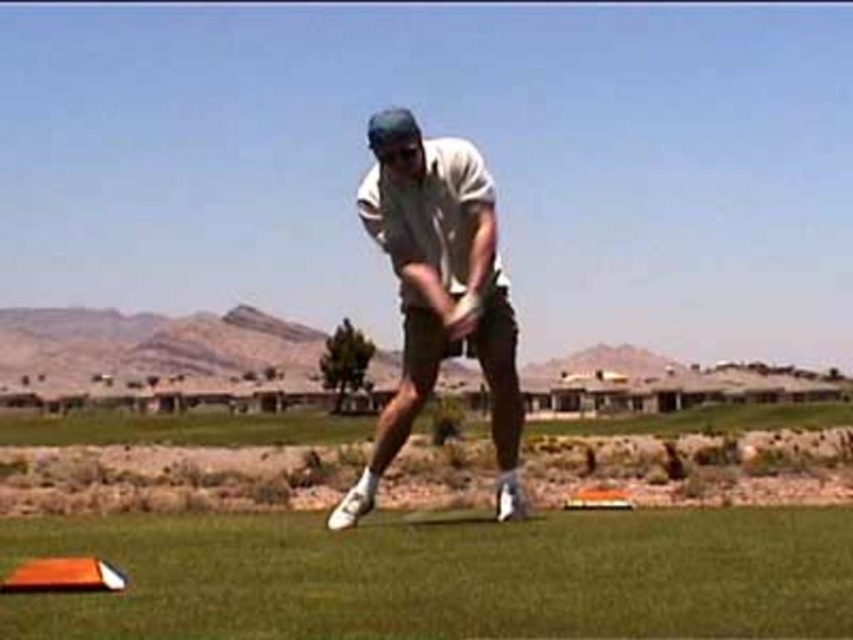
You are a golfer preparing to hit the ball. You notice the green artificial turf at lower center and the white matte golf club at center. Which object takes up more space in the image?

The white matte golf club at center takes up more space in the image than the green artificial turf at lower center because the green artificial turf at lower center occupies less space than white matte golf club at center.